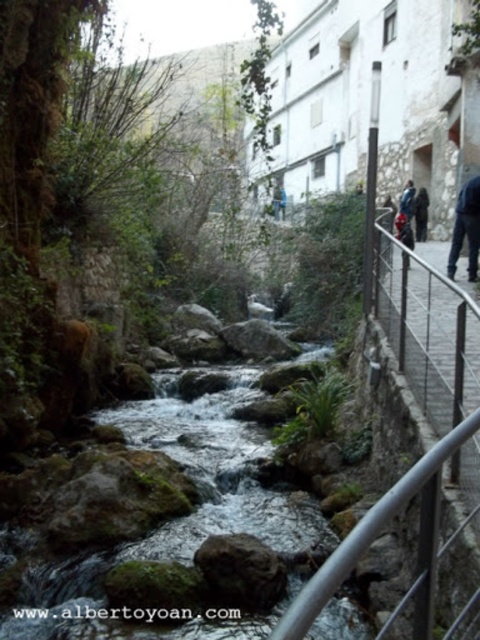
Is dark blue jeans at right above blue fabric jacket at upper center?

No.

Can you confirm if dark blue jeans at right is taller than blue fabric jacket at upper center?

Yes.

I want to click on dark blue jeans at right, so click(x=466, y=228).

Where is `dark blue jeans at right`? dark blue jeans at right is located at coordinates pyautogui.click(x=466, y=228).